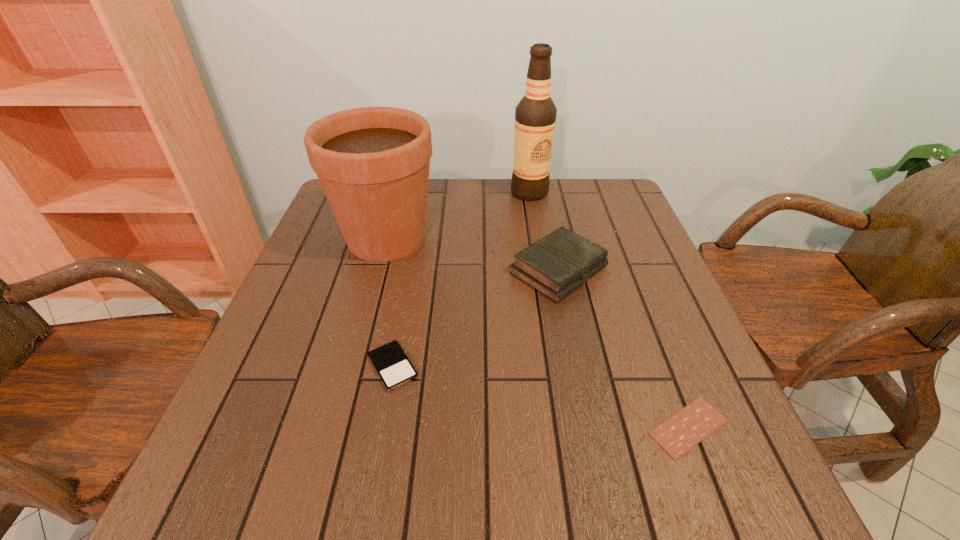
At what (x,y) coordinates should I click in order to perform the action: click on free space between the tallest object and the nearest object. Please return your answer as a coordinate pair (x, y). The height and width of the screenshot is (540, 960). Looking at the image, I should click on (609, 309).

Where is `blank region between the nearest object and the alcohol`? Image resolution: width=960 pixels, height=540 pixels. blank region between the nearest object and the alcohol is located at coordinates tap(609, 309).

At what (x,y) coordinates should I click in order to perform the action: click on vacant area between the third shortest object and the iPod. Please return your answer as a coordinate pair (x, y). This screenshot has height=540, width=960. Looking at the image, I should click on tap(476, 318).

The width and height of the screenshot is (960, 540). I want to click on object that is the closest one to the book, so click(x=373, y=163).

Where is `object that can be found as the closest to the tallest object`? object that can be found as the closest to the tallest object is located at coordinates (557, 264).

In order to click on free location that satisfies the following two spatial constraints: 1. on the front side of the chocolate bar; 2. on the left side of the fourth tallest object in this screenshot , I will do point(382,427).

At what (x,y) coordinates should I click in order to perform the action: click on free space that satisfies the following two spatial constraints: 1. on the front side of the shortest object; 2. on the left side of the third tallest object. Please return your answer as a coordinate pair (x, y). This screenshot has width=960, height=540. Looking at the image, I should click on (591, 427).

Where is `vacant space that satisfies the following two spatial constraints: 1. on the label of the third tallest object; 2. on the left side of the tallest object`? vacant space that satisfies the following two spatial constraints: 1. on the label of the third tallest object; 2. on the left side of the tallest object is located at coordinates (542, 270).

Where is `free region that satisfies the following two spatial constraints: 1. on the front side of the nearest object; 2. on the right side of the fourth shortest object`? free region that satisfies the following two spatial constraints: 1. on the front side of the nearest object; 2. on the right side of the fourth shortest object is located at coordinates (335, 427).